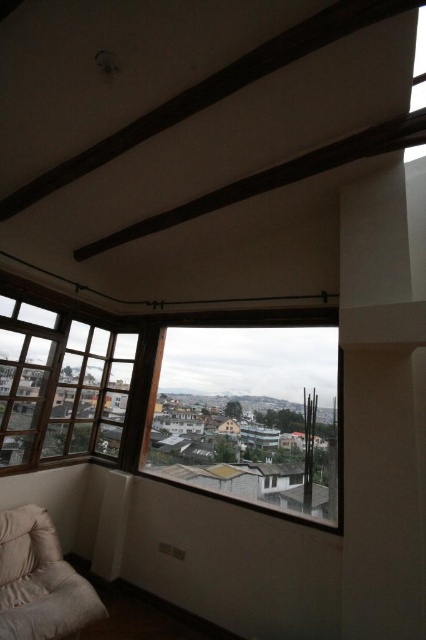
Is the position of clear glass window at left more distant than that of white soft pillow at lower left?

Yes, it is behind white soft pillow at lower left.

Who is more forward, (88, 372) or (0, 604)?

Point (0, 604)

Who is more forward, (118, 448) or (8, 593)?

Point (8, 593) is in front.

The width and height of the screenshot is (426, 640). Identify the location of clear glass window at left. (60, 385).

Does dark wood beam at upper center have a smaller size compared to beige fabric couch at lower left?

Actually, dark wood beam at upper center might be larger than beige fabric couch at lower left.

Does dark wood beam at upper center lie behind beige fabric couch at lower left?

No, dark wood beam at upper center is in front of beige fabric couch at lower left.

Where is `dark wood beam at upper center`? Image resolution: width=426 pixels, height=640 pixels. dark wood beam at upper center is located at coordinates (213, 90).

Between clear glass window at left and beige fabric couch at lower left, which one has less height?

beige fabric couch at lower left is shorter.

Measure the distance between clear glass window at left and camera.

clear glass window at left is 2.90 meters away from camera.

Locate an element on the screen. clear glass window at left is located at coordinates (60, 385).